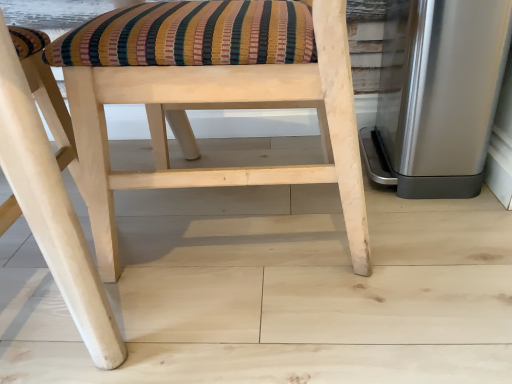
I want to click on satin silver trash can at right, so point(438,96).

This screenshot has width=512, height=384. Identify the location of natural wood chair at center, the 2th chair from the right. (51, 196).

Looking at their sizes, would you say natural wood chair at center, which appears as the 1th chair when viewed from the left, is wider or thinner than natural wood chair at center, which ranks as the second chair in left-to-right order?

natural wood chair at center, which appears as the 1th chair when viewed from the left, is wider than natural wood chair at center, which ranks as the second chair in left-to-right order.

Based on the photo, is natural wood chair at center, which appears as the 1th chair when viewed from the left, taller than natural wood chair at center, which ranks as the second chair in left-to-right order?

Yes.

From the image's perspective, is natural wood chair at center, the 2th chair from the right, beneath natural wood chair at center, which ranks as the second chair in left-to-right order?

Yes.

How much distance is there between natural wood chair at center, which appears as the 1th chair when viewed from the left, and natural wood chair at center, which appears as the 1th chair when viewed from the right?

9.19 inches.

Would you consider natural wood chair at center, which ranks as the second chair in left-to-right order, to be distant from satin silver trash can at right?

No, natural wood chair at center, which ranks as the second chair in left-to-right order, is in close proximity to satin silver trash can at right.

Does natural wood chair at center, which ranks as the second chair in left-to-right order, contain satin silver trash can at right?

No, satin silver trash can at right is not inside natural wood chair at center, which ranks as the second chair in left-to-right order.

From the image's perspective, is natural wood chair at center, which ranks as the second chair in left-to-right order, positioned above or below satin silver trash can at right?

natural wood chair at center, which ranks as the second chair in left-to-right order, is below satin silver trash can at right.

Where is `appliance behind the natural wood chair at center, which ranks as the second chair in left-to-right order`? The image size is (512, 384). appliance behind the natural wood chair at center, which ranks as the second chair in left-to-right order is located at coordinates (438, 96).

Does natural wood chair at center, the 2th chair from the right, have a smaller size compared to satin silver trash can at right?

No.

In the scene shown: Who is shorter, natural wood chair at center, the 2th chair from the right, or satin silver trash can at right?

Standing shorter between the two is satin silver trash can at right.

From the image's perspective, is natural wood chair at center, which appears as the 1th chair when viewed from the left, positioned above or below satin silver trash can at right?

Clearly, from the image's perspective, natural wood chair at center, which appears as the 1th chair when viewed from the left, is below satin silver trash can at right.

Is natural wood chair at center, the 2th chair from the right, facing towards satin silver trash can at right?

No, natural wood chair at center, the 2th chair from the right, does not turn towards satin silver trash can at right.

Which is behind, point (451, 35) or point (92, 175)?

Point (451, 35)

Is there a large distance between satin silver trash can at right and natural wood chair at center, which appears as the 1th chair when viewed from the right?

satin silver trash can at right is near natural wood chair at center, which appears as the 1th chair when viewed from the right, not far away.

Considering the sizes of satin silver trash can at right and natural wood chair at center, which appears as the 1th chair when viewed from the right, in the image, is satin silver trash can at right taller or shorter than natural wood chair at center, which appears as the 1th chair when viewed from the right,?

Considering their sizes, satin silver trash can at right has less height than natural wood chair at center, which appears as the 1th chair when viewed from the right.

From the image's perspective, is natural wood chair at center, which appears as the 1th chair when viewed from the right, above or below natural wood chair at center, which appears as the 1th chair when viewed from the left?

Clearly, from the image's perspective, natural wood chair at center, which appears as the 1th chair when viewed from the right, is above natural wood chair at center, which appears as the 1th chair when viewed from the left.

Considering the positions of objects natural wood chair at center, which appears as the 1th chair when viewed from the right, and natural wood chair at center, which appears as the 1th chair when viewed from the left, in the image provided, who is more to the right, natural wood chair at center, which appears as the 1th chair when viewed from the right, or natural wood chair at center, which appears as the 1th chair when viewed from the left,?

natural wood chair at center, which appears as the 1th chair when viewed from the right.

How many degrees apart are the facing directions of natural wood chair at center, which ranks as the second chair in left-to-right order, and natural wood chair at center, the 2th chair from the right?

There is a 91-degree angle between the facing directions of natural wood chair at center, which ranks as the second chair in left-to-right order, and natural wood chair at center, the 2th chair from the right.

Is natural wood chair at center, which appears as the 1th chair when viewed from the right, positioned behind natural wood chair at center, which appears as the 1th chair when viewed from the left?

That is True.

From a real-world perspective, starting from the satin silver trash can at right, which chair is the 2nd one vertically above it? Please provide its 2D coordinates.

[(51, 196)]

Considering the sizes of objects satin silver trash can at right and natural wood chair at center, which appears as the 1th chair when viewed from the left, in the image provided, who is taller, satin silver trash can at right or natural wood chair at center, which appears as the 1th chair when viewed from the left,?

natural wood chair at center, which appears as the 1th chair when viewed from the left.

How distant is satin silver trash can at right from natural wood chair at center, which appears as the 1th chair when viewed from the left?

satin silver trash can at right and natural wood chair at center, which appears as the 1th chair when viewed from the left, are 82.13 centimeters apart from each other.

In the scene shown: From the image's perspective, which is above, satin silver trash can at right or natural wood chair at center, which appears as the 1th chair when viewed from the left?

satin silver trash can at right appears higher in the image.

Where is `chair lying in front of the natural wood chair at center, which appears as the 1th chair when viewed from the right`? chair lying in front of the natural wood chair at center, which appears as the 1th chair when viewed from the right is located at coordinates (51, 196).

Where is `appliance that appears on the right of natural wood chair at center, which ranks as the second chair in left-to-right order`? appliance that appears on the right of natural wood chair at center, which ranks as the second chair in left-to-right order is located at coordinates (438, 96).

Looking at the image, which one is located further to satin silver trash can at right, natural wood chair at center, which ranks as the second chair in left-to-right order, or natural wood chair at center, the 2th chair from the right?

The object further to satin silver trash can at right is natural wood chair at center, the 2th chair from the right.

From the picture: Looking at the image, which one is located closer to natural wood chair at center, which appears as the 1th chair when viewed from the left, natural wood chair at center, which ranks as the second chair in left-to-right order, or satin silver trash can at right?

natural wood chair at center, which ranks as the second chair in left-to-right order, lies closer to natural wood chair at center, which appears as the 1th chair when viewed from the left, than the other object.

Which object lies further to the anchor point natural wood chair at center, which ranks as the second chair in left-to-right order, natural wood chair at center, the 2th chair from the right, or satin silver trash can at right?

satin silver trash can at right is positioned further to the anchor natural wood chair at center, which ranks as the second chair in left-to-right order.

Based on their spatial positions, is satin silver trash can at right or natural wood chair at center, which appears as the 1th chair when viewed from the right, further from natural wood chair at center, which appears as the 1th chair when viewed from the left?

satin silver trash can at right lies further to natural wood chair at center, which appears as the 1th chair when viewed from the left, than the other object.

Estimate the real-world distances between objects in this image. Which object is closer to natural wood chair at center, which appears as the 1th chair when viewed from the right, satin silver trash can at right or natural wood chair at center, the 2th chair from the right?

natural wood chair at center, the 2th chair from the right, lies closer to natural wood chair at center, which appears as the 1th chair when viewed from the right, than the other object.

Considering their positions, is natural wood chair at center, the 2th chair from the right, positioned closer to satin silver trash can at right than natural wood chair at center, which appears as the 1th chair when viewed from the right?

natural wood chair at center, which appears as the 1th chair when viewed from the right, is positioned closer to the anchor satin silver trash can at right.

This screenshot has height=384, width=512. I want to click on chair between natural wood chair at center, which appears as the 1th chair when viewed from the left, and satin silver trash can at right from left to right, so click(x=208, y=106).